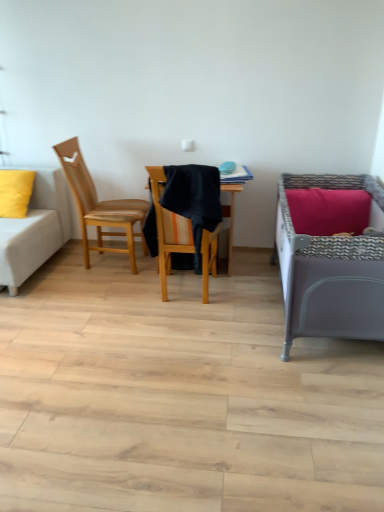
Question: Can you confirm if matte yellow pillow at left is shorter than white fabric couch at left?

Choices:
 (A) no
 (B) yes

Answer: (B)

Question: From the image's perspective, is matte yellow pillow at left under white fabric couch at left?

Choices:
 (A) no
 (B) yes

Answer: (A)

Question: Is matte yellow pillow at left at the left side of white fabric couch at left?

Choices:
 (A) yes
 (B) no

Answer: (B)

Question: Is white fabric couch at left surrounded by matte yellow pillow at left?

Choices:
 (A) no
 (B) yes

Answer: (A)

Question: Is matte yellow pillow at left in front of white fabric couch at left?

Choices:
 (A) yes
 (B) no

Answer: (B)

Question: Is point (208, 242) positioned closer to the camera than point (19, 224)?

Choices:
 (A) farther
 (B) closer

Answer: (B)

Question: From a real-world perspective, relative to white fabric couch at left, is wooden chair at center, which is the second chair from left to right, vertically above or below?

Choices:
 (A) above
 (B) below

Answer: (A)

Question: Considering the relative positions of wooden chair at center, which is the second chair from left to right, and white fabric couch at left in the image provided, is wooden chair at center, which is the second chair from left to right, to the left or to the right of white fabric couch at left?

Choices:
 (A) left
 (B) right

Answer: (B)

Question: Considering the positions of wooden chair at center, which is the second chair from left to right, and white fabric couch at left in the image, is wooden chair at center, which is the second chair from left to right, wider or thinner than white fabric couch at left?

Choices:
 (A) thin
 (B) wide

Answer: (A)

Question: Is white fabric couch at left to the left or to the right of matte yellow pillow at left in the image?

Choices:
 (A) left
 (B) right

Answer: (A)

Question: Looking at their shapes, would you say white fabric couch at left is wider or thinner than matte yellow pillow at left?

Choices:
 (A) thin
 (B) wide

Answer: (B)

Question: Is white fabric couch at left situated inside matte yellow pillow at left or outside?

Choices:
 (A) inside
 (B) outside

Answer: (B)

Question: Looking at the image, does white fabric couch at left seem bigger or smaller compared to matte yellow pillow at left?

Choices:
 (A) small
 (B) big

Answer: (B)

Question: Considering the positions of white fabric couch at left and wooden chair at left, the second chair from the right, in the image, is white fabric couch at left wider or thinner than wooden chair at left, the second chair from the right,?

Choices:
 (A) thin
 (B) wide

Answer: (B)

Question: From a real-world perspective, is white fabric couch at left positioned above or below wooden chair at left, which is counted as the 1th chair, starting from the left?

Choices:
 (A) below
 (B) above

Answer: (A)